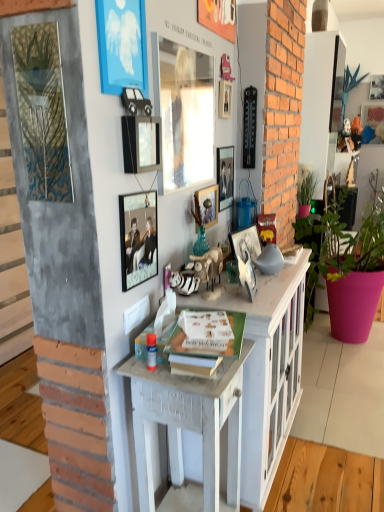
Question: Can you confirm if matte glass picture frame at center, acting as the 4th picture frame starting from the back, is smaller than metallic silver photo frame at center, positioned as the eighth picture frame in front-to-back order?

Choices:
 (A) no
 (B) yes

Answer: (B)

Question: Is matte glass picture frame at center, the fifth picture frame viewed from the right, not within metallic silver photo frame at center, positioned as the eighth picture frame in front-to-back order?

Choices:
 (A) no
 (B) yes

Answer: (B)

Question: Considering the relative positions of matte glass picture frame at center, the 6th picture frame in the left-to-right sequence, and metallic silver photo frame at center, the third picture frame from the back, in the image provided, is matte glass picture frame at center, the 6th picture frame in the left-to-right sequence, to the right of metallic silver photo frame at center, the third picture frame from the back, from the viewer's perspective?

Choices:
 (A) no
 (B) yes

Answer: (A)

Question: Considering the relative positions of matte glass picture frame at center, the fifth picture frame viewed from the right, and metallic silver photo frame at center, the 7th picture frame positioned from the left, in the image provided, is matte glass picture frame at center, the fifth picture frame viewed from the right, behind metallic silver photo frame at center, the 7th picture frame positioned from the left,?

Choices:
 (A) yes
 (B) no

Answer: (B)

Question: Is matte glass picture frame at center, the fifth picture frame viewed from the right, oriented away from metallic silver photo frame at center, positioned as the eighth picture frame in front-to-back order?

Choices:
 (A) yes
 (B) no

Answer: (B)

Question: Is matte glass picture frame at center, acting as the seventh picture frame starting from the front, bigger than metallic silver photo frame at center, the fourth picture frame when ordered from right to left?

Choices:
 (A) yes
 (B) no

Answer: (B)

Question: Is green matte plant at right, arranged as the second houseplant when viewed from the right, located outside matte glass picture frame at upper center, which is the 6th picture frame from back to front?

Choices:
 (A) no
 (B) yes

Answer: (B)

Question: Is green matte plant at right, arranged as the second houseplant when viewed from the right, taller than matte glass picture frame at upper center, which is the 6th picture frame from back to front?

Choices:
 (A) yes
 (B) no

Answer: (B)

Question: Does green matte plant at right, arranged as the second houseplant when viewed from the right, appear on the left side of matte glass picture frame at upper center, which is the sixth picture frame from right to left?

Choices:
 (A) no
 (B) yes

Answer: (A)

Question: Considering the relative sizes of green matte plant at right, which ranks as the 1th houseplant in left-to-right order, and matte glass picture frame at upper center, which is the 6th picture frame from back to front, in the image provided, is green matte plant at right, which ranks as the 1th houseplant in left-to-right order, shorter than matte glass picture frame at upper center, which is the 6th picture frame from back to front,?

Choices:
 (A) yes
 (B) no

Answer: (A)

Question: Is matte glass picture frame at upper center, positioned as the fifth picture frame in front-to-back order, surrounded by green matte plant at right, which ranks as the 1th houseplant in left-to-right order?

Choices:
 (A) yes
 (B) no

Answer: (B)

Question: From the image's perspective, is green matte plant at right, which ranks as the 1th houseplant in left-to-right order, over matte glass picture frame at upper center, which is the 6th picture frame from back to front?

Choices:
 (A) no
 (B) yes

Answer: (A)

Question: Is pink matte pot at right, which appears as the second houseplant when viewed from the left, to the left of metallic silver photo frame at center, positioned as the eighth picture frame in front-to-back order, from the viewer's perspective?

Choices:
 (A) no
 (B) yes

Answer: (A)